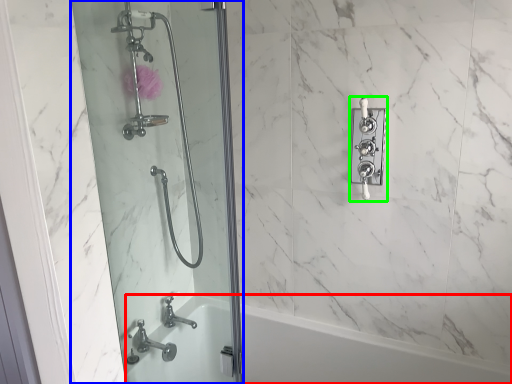
Question: Based on their relative distances, which object is nearer to bath (highlighted by a red box)? Choose from screen door (highlighted by a blue box) and lock (highlighted by a green box).

Choices:
 (A) screen door
 (B) lock

Answer: (A)